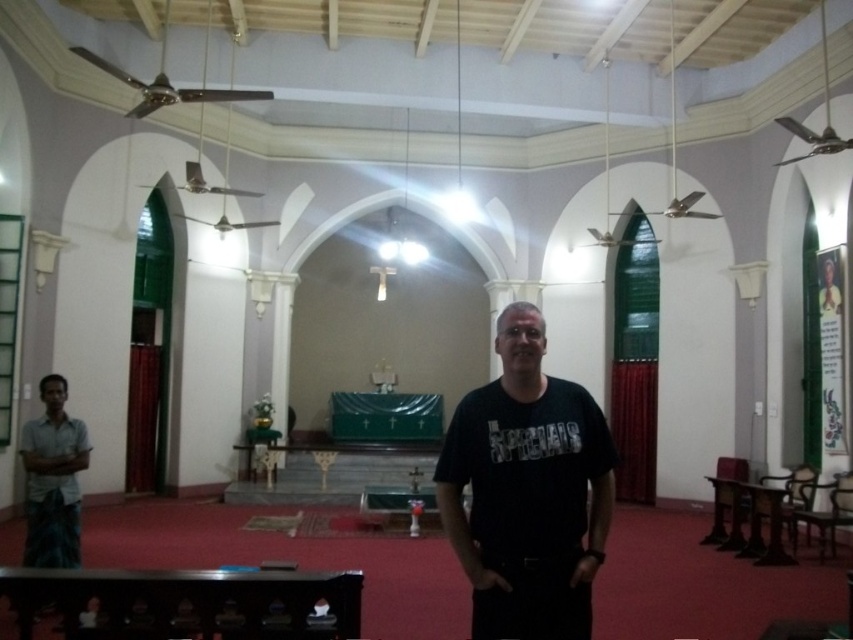
Who is positioned more to the right, black matte t-shirt at center or light gray fabric shirt at left?

From the viewer's perspective, black matte t-shirt at center appears more on the right side.

How distant is black matte t-shirt at center from light gray fabric shirt at left?

black matte t-shirt at center and light gray fabric shirt at left are 3.68 meters apart.

Measure the distance between point (596, 528) and camera.

Point (596, 528) is 8.79 feet away from camera.

Where is `black matte t-shirt at center`? black matte t-shirt at center is located at coordinates (527, 492).